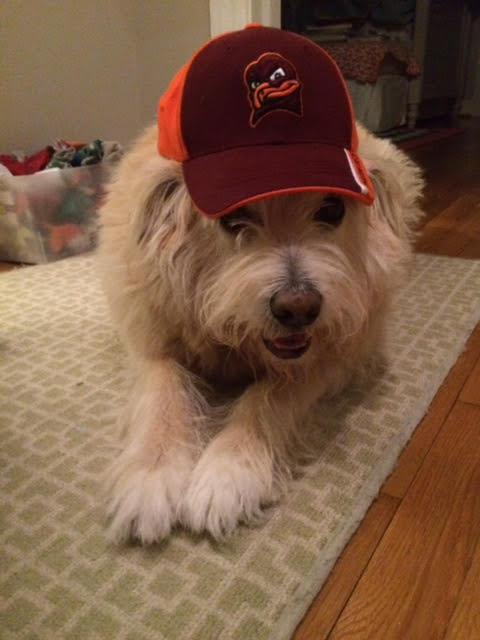
Identify the location of plastic bin. This screenshot has height=640, width=480. (47, 214).